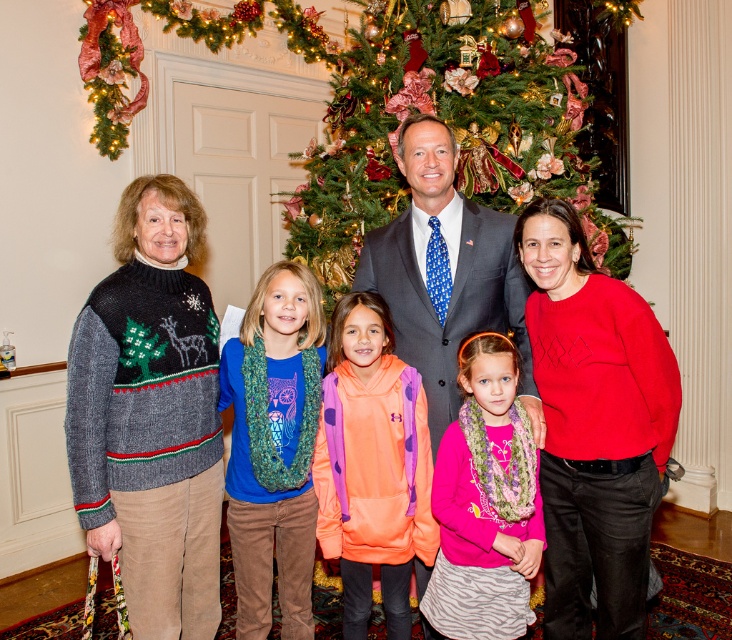
Question: Which object appears farthest from the camera in this image?

Choices:
 (A) knitted sweater at center
 (B) pink fleece sweater at center

Answer: (B)

Question: Among these objects, which one is farthest from the camera?

Choices:
 (A) knitted sweater at center
 (B) orange fleece hoodie at center
 (C) pink fleece sweater at center

Answer: (B)

Question: From the image, what is the correct spatial relationship of pink fleece sweater at center in relation to knitted sweater at center?

Choices:
 (A) left
 (B) right

Answer: (A)

Question: Considering the relative positions of pink fleece sweater at center and knitted sweater at center in the image provided, where is pink fleece sweater at center located with respect to knitted sweater at center?

Choices:
 (A) above
 (B) below

Answer: (B)

Question: Does green textured christmas tree at center have a lesser width compared to pink fleece sweater at center?

Choices:
 (A) yes
 (B) no

Answer: (B)

Question: Which is nearer to the green textured christmas tree at center?

Choices:
 (A) knitted sweater at center
 (B) orange fleece hoodie at center
 (C) pink fleece sweater at center

Answer: (A)